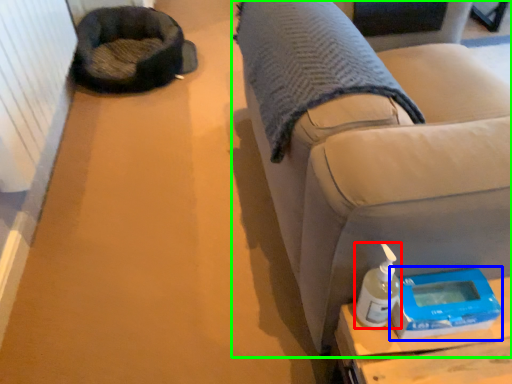
Question: Which object is the closest to the bottle (highlighted by a red box)? Choose among these: scale (highlighted by a blue box) or furniture (highlighted by a green box).

Choices:
 (A) scale
 (B) furniture

Answer: (A)